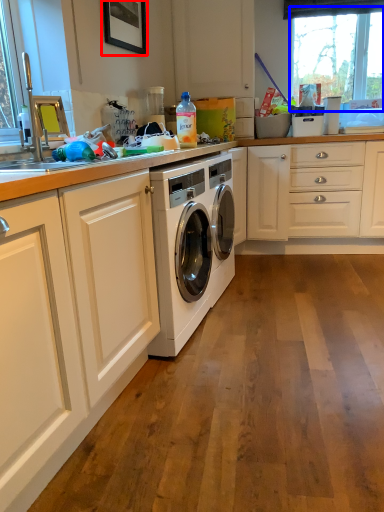
Question: Which object appears farthest to the camera in this image, picture frame (highlighted by a red box) or window (highlighted by a blue box)?

Choices:
 (A) picture frame
 (B) window

Answer: (B)